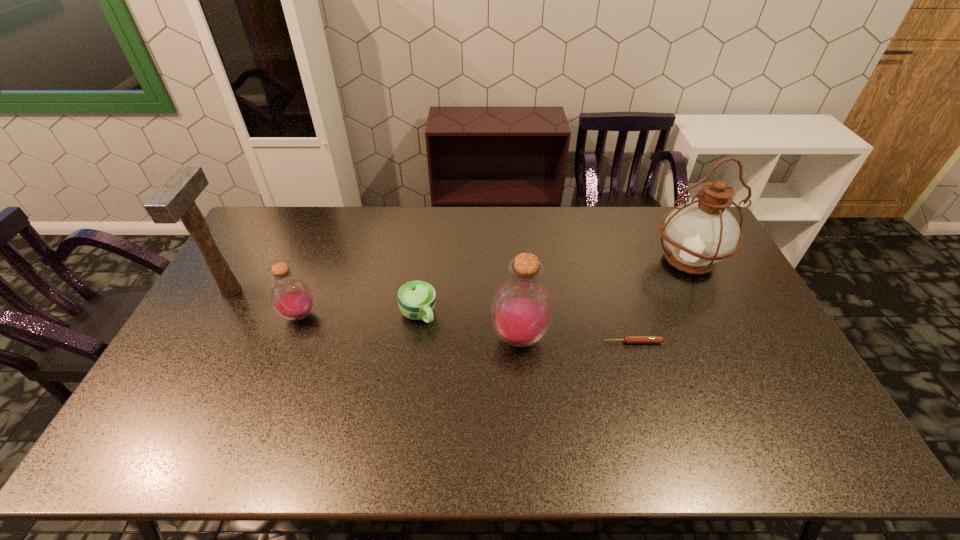
Locate an element on the screen. free location located 0.240m on the left of the fourth tallest object is located at coordinates (202, 315).

This screenshot has width=960, height=540. I want to click on free location located 0.140m on the front of the taller bottle, so click(525, 408).

Identify the location of vacant region located 0.310m on the front of the rightmost object. This screenshot has height=540, width=960. (742, 368).

Locate an element on the screen. This screenshot has height=540, width=960. vacant space located 0.340m on the back of the leftmost object is located at coordinates (276, 212).

I want to click on vacant space located 0.220m on the left of the shortest object, so click(x=527, y=342).

The height and width of the screenshot is (540, 960). I want to click on vacant space located 0.190m on the back of the third object from left to right, so coord(426,259).

The width and height of the screenshot is (960, 540). What are the coordinates of `object that is at the far edge` in the screenshot? It's located at (698, 234).

Where is `object present at the left edge`? The image size is (960, 540). object present at the left edge is located at coordinates (175, 200).

The width and height of the screenshot is (960, 540). I want to click on object present at the right edge, so click(698, 234).

You are a GUI agent. You are given a task and a screenshot of the screen. Output one action in this format:
    pyautogui.click(x=<x>, y=<y>)
    Task: Click on the object that is positioned at the far right corner
    The image size is (960, 540).
    Given the screenshot: What is the action you would take?
    pyautogui.click(x=698, y=234)